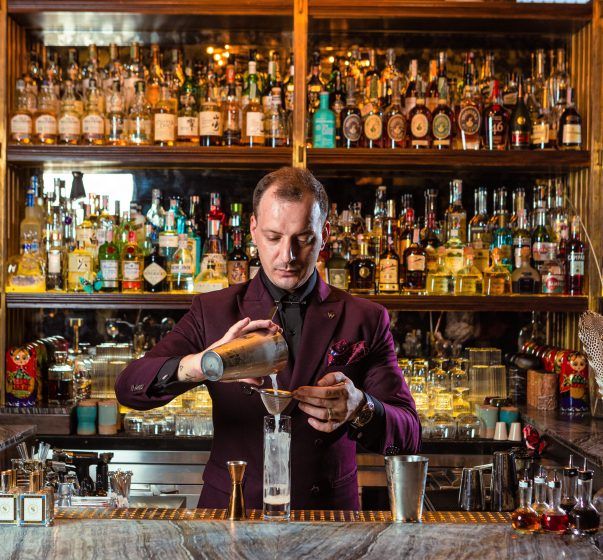
In order to click on glass in this screenshot , I will do `click(277, 442)`.